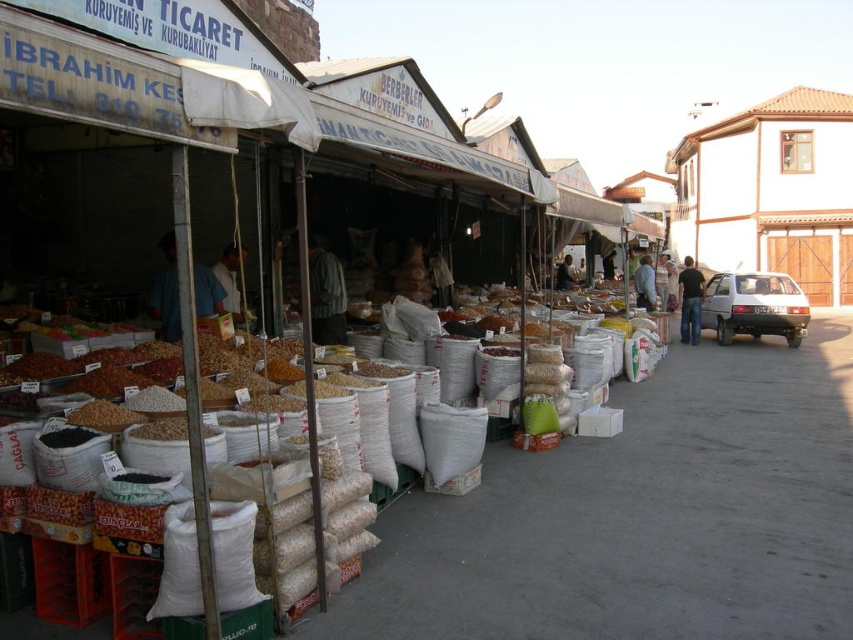
Does point (213, 301) come behind point (318, 308)?

That is False.

Where is `blue shirt at center`? blue shirt at center is located at coordinates (166, 292).

In the scene shown: Which of these two, brown grain at center or striped fabric shirt at center, stands taller?

Standing taller between the two is striped fabric shirt at center.

Is brown grain at center behind striped fabric shirt at center?

That is False.

The width and height of the screenshot is (853, 640). In order to click on brown grain at center in this screenshot , I will do `click(161, 429)`.

Identify the location of brown grain at center. (161, 429).

Is the position of brown grain at center less distant than that of dark blue shirt at center?

Yes, it is.

Consider the image. Does brown grain at center have a greater height compared to dark blue shirt at center?

In fact, brown grain at center may be shorter than dark blue shirt at center.

Is point (144, 433) closer to camera compared to point (556, 282)?

Yes, it is in front of point (556, 282).

I want to click on brown grain at center, so click(161, 429).